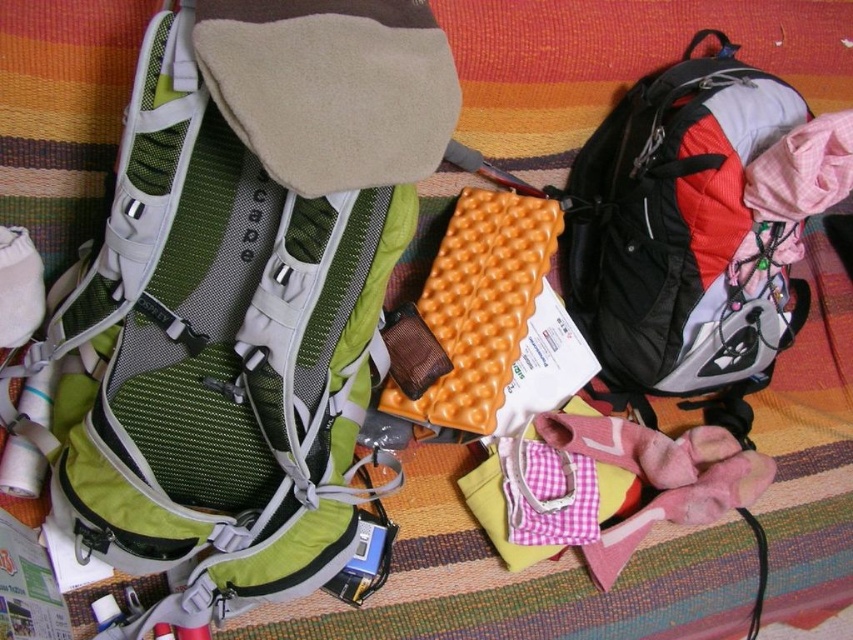
You are setting up a campsite and need to place a tent. The tent requires a clear space of 1 meter in diameter. Is there enough space between the green mesh backpack at upper left and the sleeping pad between the backpacks?

The position of the green mesh backpack at upper left is at point (216, 356). However, without knowing the exact position and size of the sleeping pad between the backpacks, it is impossible to determine if there is enough space for the tent.

You are setting up a campsite and need to access your gear. You see the green mesh backpack at upper left and the matte black backpack at right. Which backpack is easier to reach without moving the other items?

The green mesh backpack at upper left is closer to the viewer than the matte black backpack at right, so it is easier to reach without moving other items.

You are setting up a campsite and need to place a 30 inch tent pole between the green mesh backpack at upper left and the camera. Can you fit the tent pole between them without overlapping either item?

The distance between the green mesh backpack at upper left and the camera is 30.13 inches, so yes, the 30 inch tent pole can fit between them without overlapping either item since there is enough space.